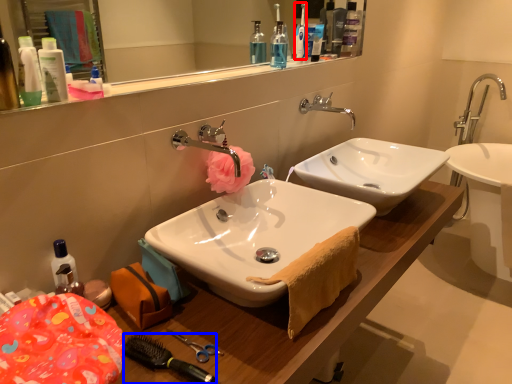
Question: Which point is further to the camera, toothbrush (highlighted by a red box) or brush (highlighted by a blue box)?

Choices:
 (A) toothbrush
 (B) brush

Answer: (A)